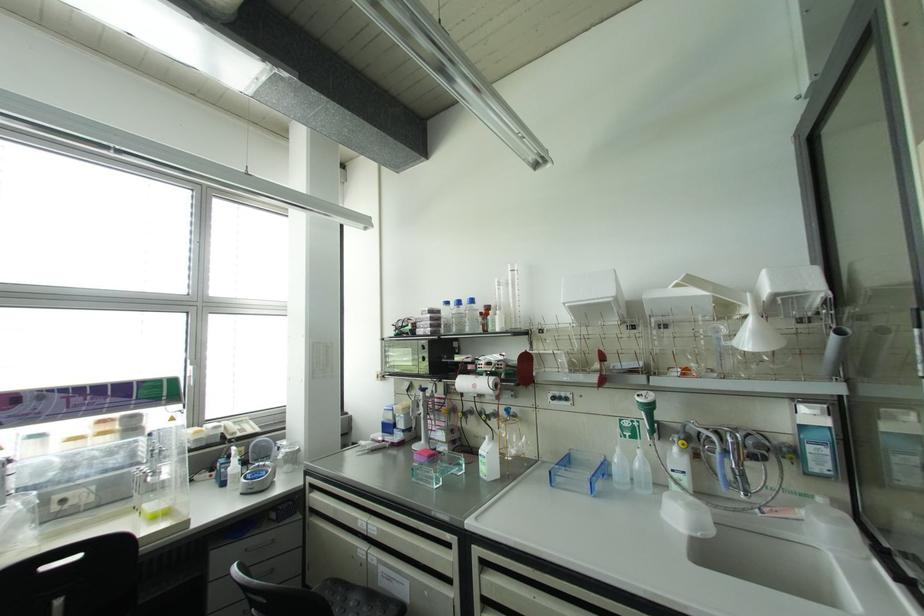
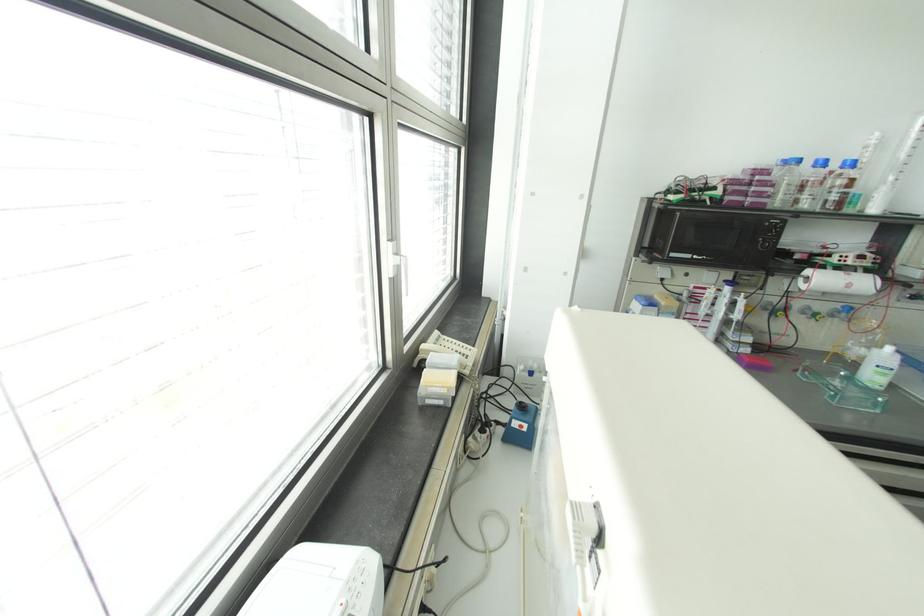
Question: I am providing you with two images of the same scene from different viewpoints. After the viewpoint changes to image2, which objects are now occluded?

Choices:
 (A) pitcher handle
 (B) graduated cylinder
 (C) chair sitting surface
 (D) pipettor

Answer: (C)